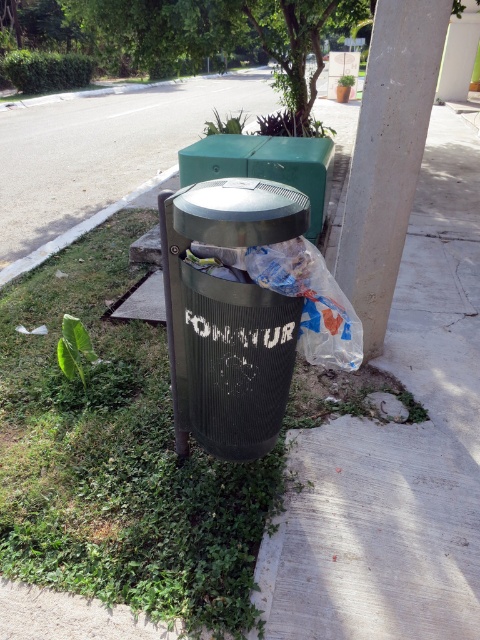
You are a gardener who needs to mow the grass near the white concrete pillar at upper right and the green grass at lower left. Which area requires mowing first if you want to start with the shorter vegetation?

The green grass at lower left is shorter than the white concrete pillar at upper right, so you should mow the green grass at lower left first since it is the shorter vegetation.

You are a gardener who needs to mow the lawn. You see the green grass at lower left and the white concrete pillar at upper right. Which area requires more time to mow?

The green grass at lower left requires more time to mow because it is larger in size than the white concrete pillar at upper right.

You are standing at the center of the sidewalk in the image. There is a point marked at coordinates (118, 456). What object is located at this point?

The green grass at lower left is located at point (118, 456).